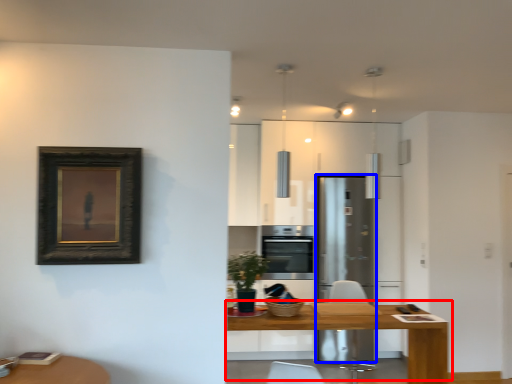
Question: Among these objects, which one is nearest to the camera, table (highlighted by a red box) or fridge (highlighted by a blue box)?

Choices:
 (A) table
 (B) fridge

Answer: (A)